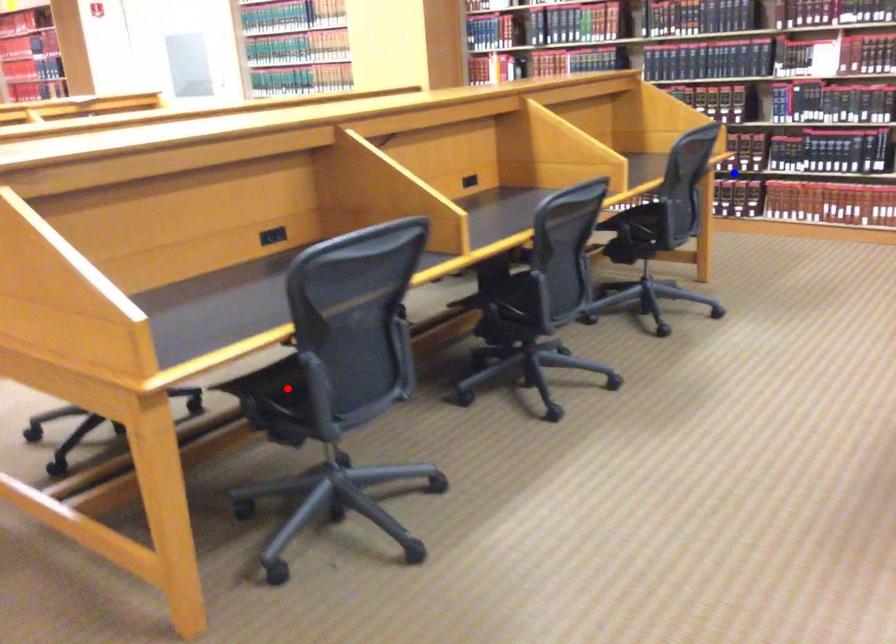
Question: In the image, two points are highlighted. Which point is nearer to the camera? Reply with the corresponding letter.

Choices:
 (A) blue point
 (B) red point

Answer: (B)